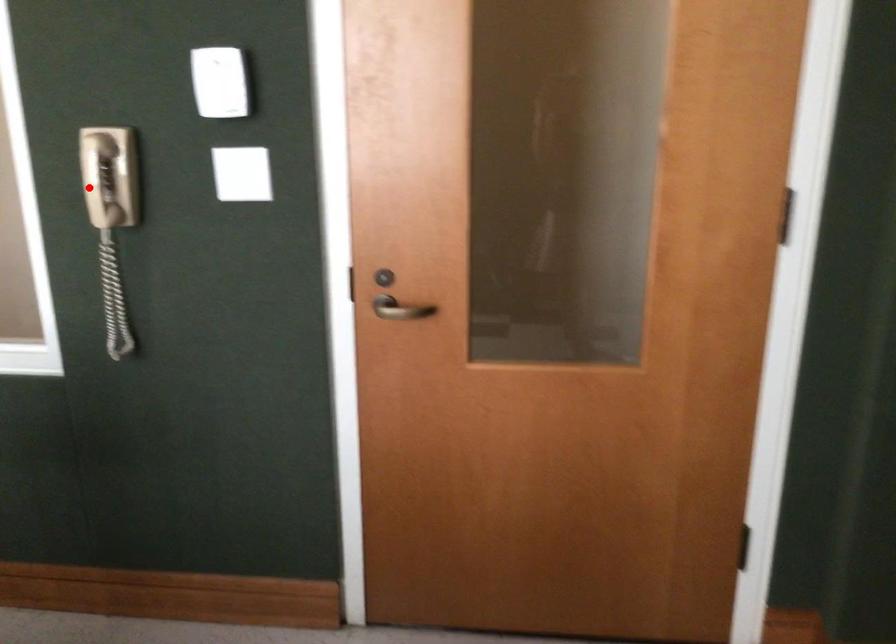
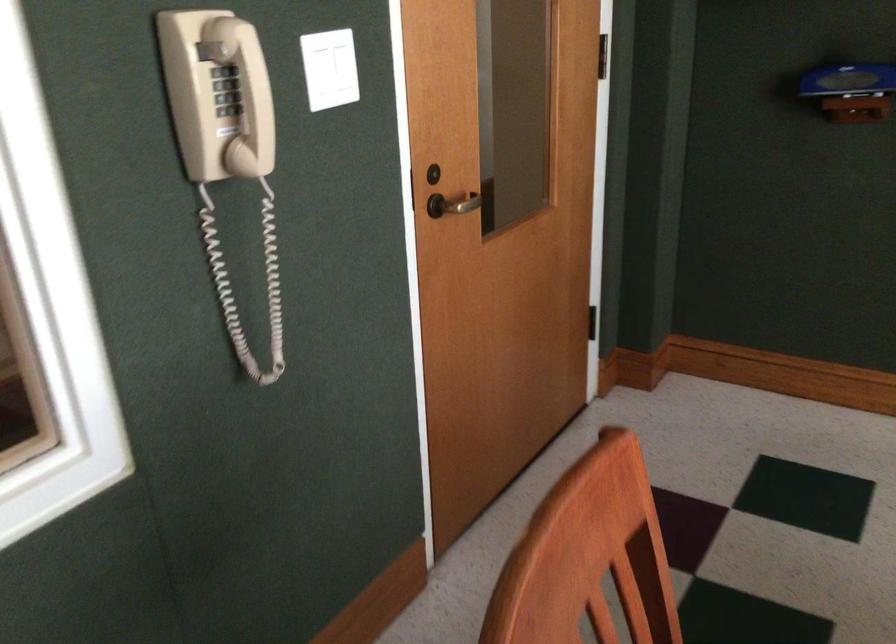
Question: A red point is marked in image1. In image2, is the corresponding 3D point closer to the camera or farther? Reply with the corresponding letter.

Choices:
 (A) The corresponding 3D point is closer.
 (B) The corresponding 3D point is farther.

Answer: (A)